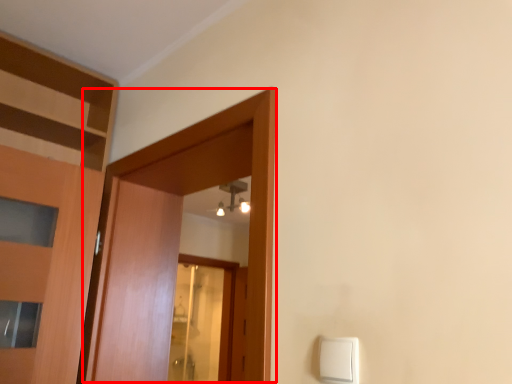
Question: From the image's perspective, where is door (annotated by the red box) located relative to light switch?

Choices:
 (A) below
 (B) above

Answer: (B)